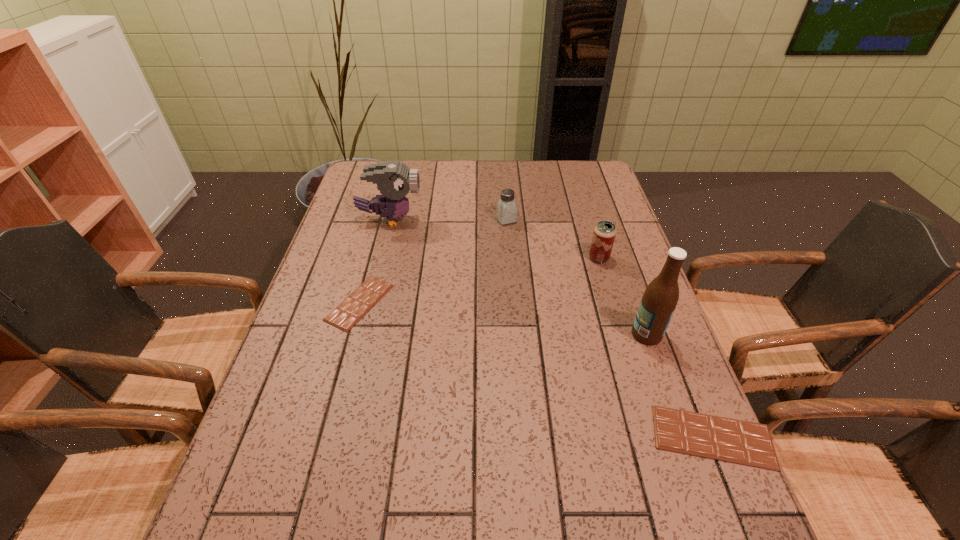
To make them evenly spaced by inserting another chocolate_bar among them, please locate a free space for this new chocolate_bar. Please provide its 2D coordinates. Your answer should be formatted as a tuple, i.e. [(x, y)], where the tuple contains the x and y coordinates of a point satisfying the conditions above.

[(513, 361)]